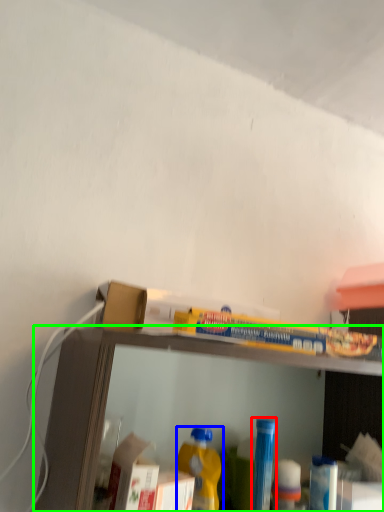
Question: Which object is the farthest from bottle (highlighted by a red box)? Choose among these: bottle (highlighted by a blue box) or shelf (highlighted by a green box).

Choices:
 (A) bottle
 (B) shelf

Answer: (B)